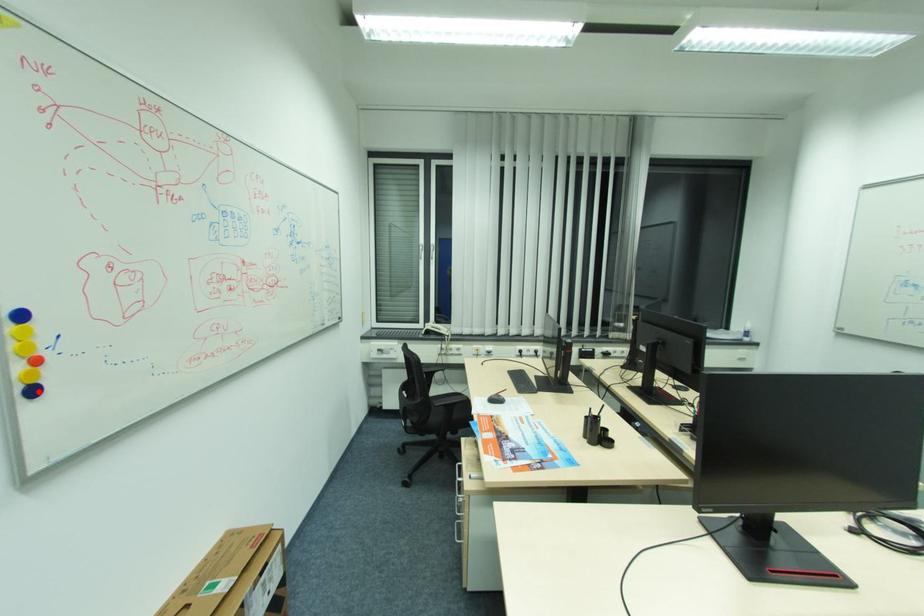
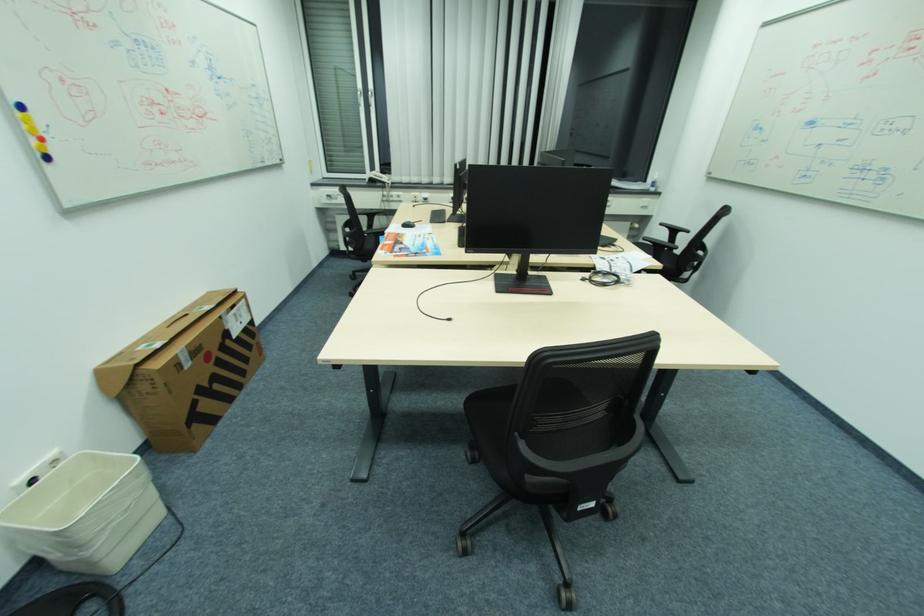
In the second image, find the point that corresponds to the highlighted location in the first image.

(52, 158)